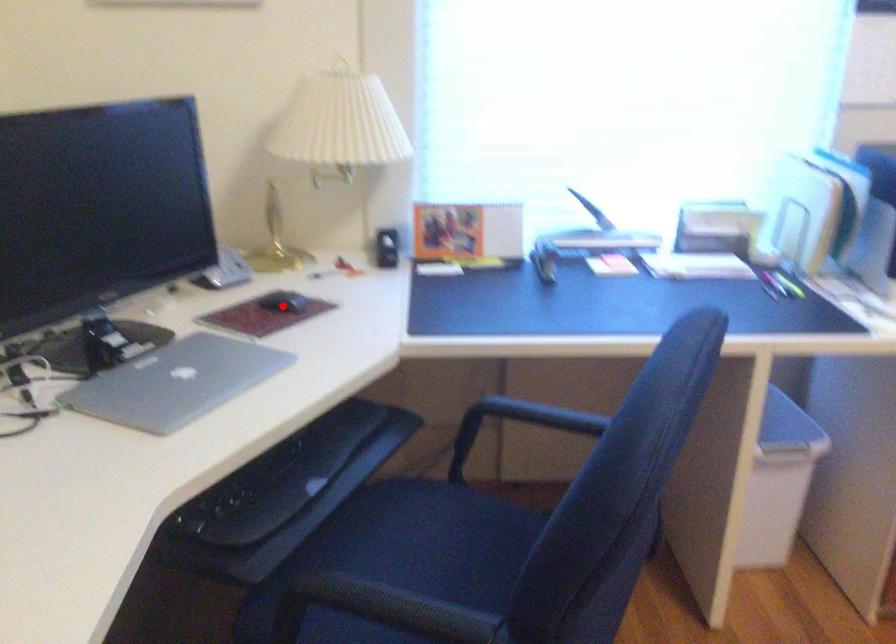
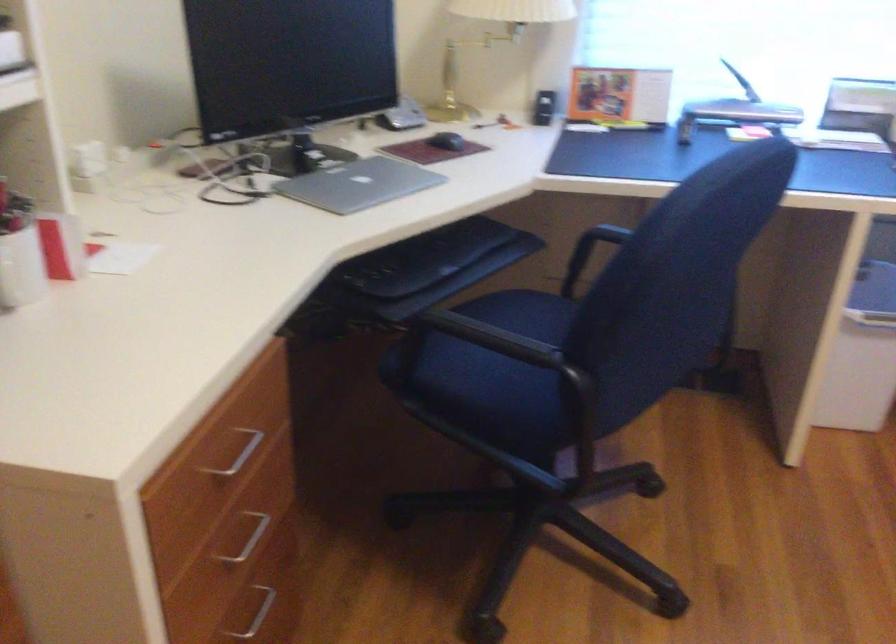
Question: I am providing you with two images of the same scene from different viewpoints. Given a red point in image1, look at the same physical point in image2. Is it:

Choices:
 (A) Closer to the viewpoint
 (B) Farther from the viewpoint

Answer: (B)